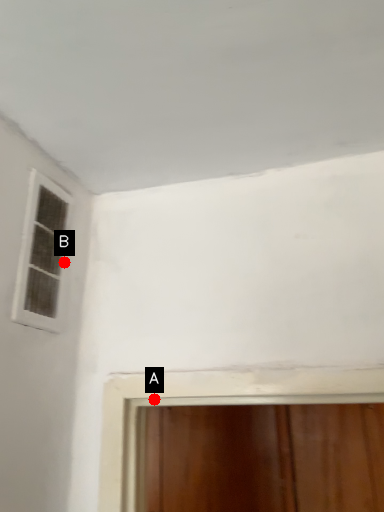
Question: Two points are circled on the image, labeled by A and B beside each circle. Which point is closer to the camera taking this photo?

Choices:
 (A) A is closer
 (B) B is closer

Answer: (A)